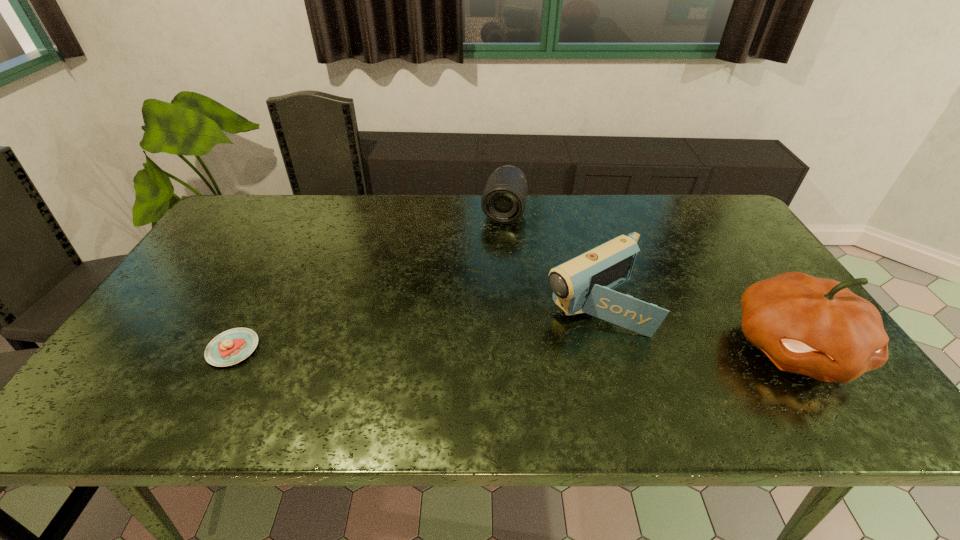
This screenshot has height=540, width=960. I want to click on the shortest object, so click(232, 346).

Identify the location of pastry. This screenshot has width=960, height=540. (232, 346).

Find the location of a particular element. The height and width of the screenshot is (540, 960). pumpkin is located at coordinates (817, 327).

The image size is (960, 540). In order to click on the rightmost object in this screenshot , I will do `click(817, 327)`.

Find the location of a particular element. This screenshot has width=960, height=540. the second object from right to left is located at coordinates (585, 284).

Where is `the third tallest object`? This screenshot has width=960, height=540. the third tallest object is located at coordinates (503, 201).

Locate an element on the screen. The image size is (960, 540). telephoto lens is located at coordinates (503, 201).

Image resolution: width=960 pixels, height=540 pixels. I want to click on free space located 0.350m on the back of the pastry, so click(x=288, y=244).

You are a GUI agent. You are given a task and a screenshot of the screen. Output one action in this format:
    pyautogui.click(x=<x>, y=<y>)
    Task: Click on the vacant area situated on the side of the camcorder with the flip-out screen
    
    Given the screenshot: What is the action you would take?
    pyautogui.click(x=446, y=383)

This screenshot has width=960, height=540. I want to click on vacant space located 0.300m on the side of the camcorder with the flip-out screen, so click(454, 380).